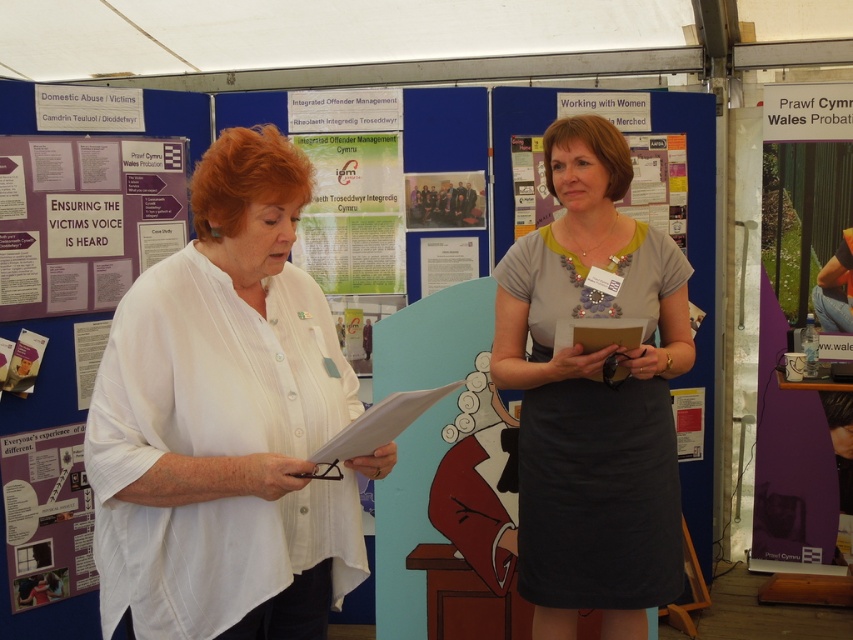
Question: Where is white matte shirt at center located in relation to matte black group photo at center in the image?

Choices:
 (A) below
 (B) above

Answer: (A)

Question: Does purple paper poster at upper left appear over matte black group photo at center?

Choices:
 (A) yes
 (B) no

Answer: (B)

Question: Which of the following is the farthest from the observer?

Choices:
 (A) matte black group photo at center
 (B) matte gray dress at center

Answer: (A)

Question: Which is nearer to the purple paper at lower left?

Choices:
 (A) purple paper at upper left
 (B) matte black group photo at center
 (C) white matte shirt at center

Answer: (A)

Question: Can you confirm if white matte shirt at center is thinner than matte black group photo at center?

Choices:
 (A) no
 (B) yes

Answer: (A)

Question: Which point is farther to the camera?

Choices:
 (A) (13, 476)
 (B) (115, 227)

Answer: (B)